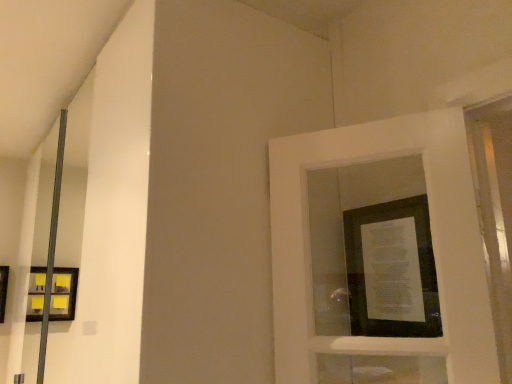
In order to face matte black picture frame at center, the first picture frame in the right-to-left sequence, should I rotate leftwards or rightwards?

Turn right approximately 16.822 degrees to face it.

Identify the location of matte black picture frame at center, acting as the second picture frame starting from the back. The height and width of the screenshot is (384, 512). (391, 270).

What do you see at coordinates (391, 270) in the screenshot? I see `matte black picture frame at center, which is the 2th picture frame in bottom-to-top order` at bounding box center [391, 270].

Where is `matte black picture frame at left, which appears as the first picture frame when ordered from the bottom`? The height and width of the screenshot is (384, 512). matte black picture frame at left, which appears as the first picture frame when ordered from the bottom is located at coordinates [x=3, y=291].

Image resolution: width=512 pixels, height=384 pixels. Describe the element at coordinates (3, 291) in the screenshot. I see `matte black picture frame at left, which appears as the first picture frame when viewed from the back` at that location.

How much space does matte black picture frame at left, which ranks as the 2th picture frame in top-to-bottom order, occupy vertically?

13.64 inches.

Where is `matte black picture frame at center, the first picture frame in the right-to-left sequence`? matte black picture frame at center, the first picture frame in the right-to-left sequence is located at coordinates (391, 270).

Can you confirm if matte black picture frame at center, which appears as the 1th picture frame when viewed from the top, is positioned to the left of matte black picture frame at left, arranged as the 2th picture frame when viewed from the right?

No.

Is matte black picture frame at center, the first picture frame in the right-to-left sequence, behind matte black picture frame at left, arranged as the 2th picture frame when viewed from the right?

No, the depth of matte black picture frame at center, the first picture frame in the right-to-left sequence, is less than that of matte black picture frame at left, arranged as the 2th picture frame when viewed from the right.

Between point (393, 250) and point (0, 291), which one is positioned in front?

The point (393, 250) is closer to the camera.

From the image's perspective, between matte black picture frame at center, which appears as the 1th picture frame when viewed from the top, and matte black picture frame at left, which is counted as the first picture frame, starting from the left, which one is located above?

matte black picture frame at center, which appears as the 1th picture frame when viewed from the top.

From a real-world perspective, which is physically above, matte black picture frame at center, which appears as the 1th picture frame when viewed from the top, or matte black picture frame at left, which is counted as the first picture frame, starting from the left?

matte black picture frame at center, which appears as the 1th picture frame when viewed from the top.

Looking at their sizes, would you say matte black picture frame at center, which appears as the 1th picture frame when viewed from the top, is wider or thinner than matte black picture frame at left, the 2th picture frame from the front?

In the image, matte black picture frame at center, which appears as the 1th picture frame when viewed from the top, appears to be more narrow than matte black picture frame at left, the 2th picture frame from the front.

Considering the sizes of objects matte black picture frame at center, acting as the second picture frame starting from the back, and matte black picture frame at left, which appears as the first picture frame when viewed from the back, in the image provided, who is taller, matte black picture frame at center, acting as the second picture frame starting from the back, or matte black picture frame at left, which appears as the first picture frame when viewed from the back,?

Standing taller between the two is matte black picture frame at center, acting as the second picture frame starting from the back.

Between matte black picture frame at center, which is the 2th picture frame in bottom-to-top order, and matte black picture frame at left, which ranks as the 2th picture frame in top-to-bottom order, which one has larger size?

Bigger between the two is matte black picture frame at left, which ranks as the 2th picture frame in top-to-bottom order.

Would you say matte black picture frame at center, the first picture frame in the right-to-left sequence, is inside or outside matte black picture frame at left, which is counted as the first picture frame, starting from the left?

matte black picture frame at center, the first picture frame in the right-to-left sequence, cannot be found inside matte black picture frame at left, which is counted as the first picture frame, starting from the left.

Is matte black picture frame at center, the 2th picture frame viewed from the left, far from matte black picture frame at left, which ranks as the 2th picture frame in top-to-bottom order?

Yes, matte black picture frame at center, the 2th picture frame viewed from the left, and matte black picture frame at left, which ranks as the 2th picture frame in top-to-bottom order, are quite far apart.

Is matte black picture frame at center, the first picture frame in the right-to-left sequence, oriented towards matte black picture frame at left, which ranks as the 2th picture frame in top-to-bottom order?

No, matte black picture frame at center, the first picture frame in the right-to-left sequence, does not turn towards matte black picture frame at left, which ranks as the 2th picture frame in top-to-bottom order.

How many degrees apart are the facing directions of matte black picture frame at center, the 2th picture frame viewed from the left, and matte black picture frame at left, which appears as the first picture frame when ordered from the bottom?

90 degrees separate the facing orientations of matte black picture frame at center, the 2th picture frame viewed from the left, and matte black picture frame at left, which appears as the first picture frame when ordered from the bottom.

How far apart are matte black picture frame at center, which appears as the 1th picture frame when viewed from the top, and matte black picture frame at left, arranged as the 2th picture frame when viewed from the right?

2.44 meters.

Locate an element on the screen. The width and height of the screenshot is (512, 384). picture frame on the left of matte black picture frame at center, which appears as the 1th picture frame when viewed from the top is located at coordinates (3, 291).

Which is more to the left, matte black picture frame at left, which ranks as the 2th picture frame in top-to-bottom order, or matte black picture frame at center, which is the 2th picture frame in bottom-to-top order?

From the viewer's perspective, matte black picture frame at left, which ranks as the 2th picture frame in top-to-bottom order, appears more on the left side.

From the picture: Is matte black picture frame at left, arranged as the 2th picture frame when viewed from the right, closer to the viewer compared to matte black picture frame at center, the 2th picture frame viewed from the left?

That is False.

Does point (1, 300) come in front of point (397, 328)?

No, it is not.

From the image's perspective, is matte black picture frame at left, which is counted as the first picture frame, starting from the left, on matte black picture frame at center, the 2th picture frame viewed from the left?

Incorrect, from the image's perspective, matte black picture frame at left, which is counted as the first picture frame, starting from the left, is lower than matte black picture frame at center, the 2th picture frame viewed from the left.

From a real-world perspective, which is physically below, matte black picture frame at left, which ranks as the 2th picture frame in top-to-bottom order, or matte black picture frame at center, the first picture frame in the right-to-left sequence?

In real-world perspective, matte black picture frame at left, which ranks as the 2th picture frame in top-to-bottom order, is lower.

Considering the relative sizes of matte black picture frame at left, the 2th picture frame from the front, and matte black picture frame at center, the first picture frame in the right-to-left sequence, in the image provided, is matte black picture frame at left, the 2th picture frame from the front, wider than matte black picture frame at center, the first picture frame in the right-to-left sequence,?

Yes, matte black picture frame at left, the 2th picture frame from the front, is wider than matte black picture frame at center, the first picture frame in the right-to-left sequence.

In the scene shown: Who is shorter, matte black picture frame at left, which appears as the first picture frame when ordered from the bottom, or matte black picture frame at center, acting as the second picture frame starting from the back?

With less height is matte black picture frame at left, which appears as the first picture frame when ordered from the bottom.

Considering the sizes of objects matte black picture frame at left, which is counted as the first picture frame, starting from the left, and matte black picture frame at center, the first picture frame in the right-to-left sequence, in the image provided, who is bigger, matte black picture frame at left, which is counted as the first picture frame, starting from the left, or matte black picture frame at center, the first picture frame in the right-to-left sequence,?

Bigger between the two is matte black picture frame at left, which is counted as the first picture frame, starting from the left.

Is matte black picture frame at left, arranged as the 2th picture frame when viewed from the right, completely or partially outside of matte black picture frame at center, which appears as the 1th picture frame when viewed from the top?

Yes, matte black picture frame at left, arranged as the 2th picture frame when viewed from the right, is located beyond the bounds of matte black picture frame at center, which appears as the 1th picture frame when viewed from the top.

Are matte black picture frame at left, which appears as the first picture frame when ordered from the bottom, and matte black picture frame at center, the 2th picture frame viewed from the left, making contact?

No, matte black picture frame at left, which appears as the first picture frame when ordered from the bottom, is not with matte black picture frame at center, the 2th picture frame viewed from the left.

Is matte black picture frame at left, which appears as the first picture frame when ordered from the bottom, turned away from matte black picture frame at center, the 2th picture frame viewed from the left?

matte black picture frame at left, which appears as the first picture frame when ordered from the bottom, does not have its back to matte black picture frame at center, the 2th picture frame viewed from the left.

How different are the orientations of matte black picture frame at left, which is counted as the first picture frame, starting from the left, and matte black picture frame at center, which appears as the 1th picture frame when viewed from the top, in degrees?

The angular difference between matte black picture frame at left, which is counted as the first picture frame, starting from the left, and matte black picture frame at center, which appears as the 1th picture frame when viewed from the top, is 90 degrees.

In the scene shown: How far apart are matte black picture frame at left, which ranks as the 2th picture frame in top-to-bottom order, and matte black picture frame at center, which appears as the 1th picture frame when viewed from the top?

A distance of 2.44 meters exists between matte black picture frame at left, which ranks as the 2th picture frame in top-to-bottom order, and matte black picture frame at center, which appears as the 1th picture frame when viewed from the top.

Identify the location of picture frame that appears below the matte black picture frame at center, which appears as the 1th picture frame when viewed from the top (from the image's perspective). Image resolution: width=512 pixels, height=384 pixels. (3, 291).

This screenshot has width=512, height=384. I want to click on picture frame behind the matte black picture frame at center, which appears as the 1th picture frame when viewed from the top, so click(3, 291).

Identify the location of picture frame located underneath the matte black picture frame at center, acting as the second picture frame starting from the back (from a real-world perspective). Image resolution: width=512 pixels, height=384 pixels. (3, 291).